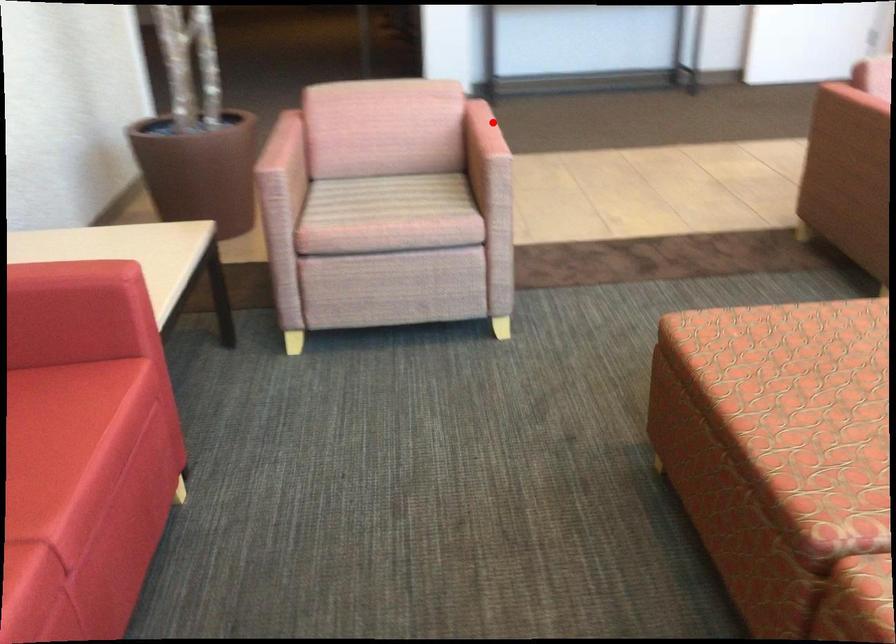
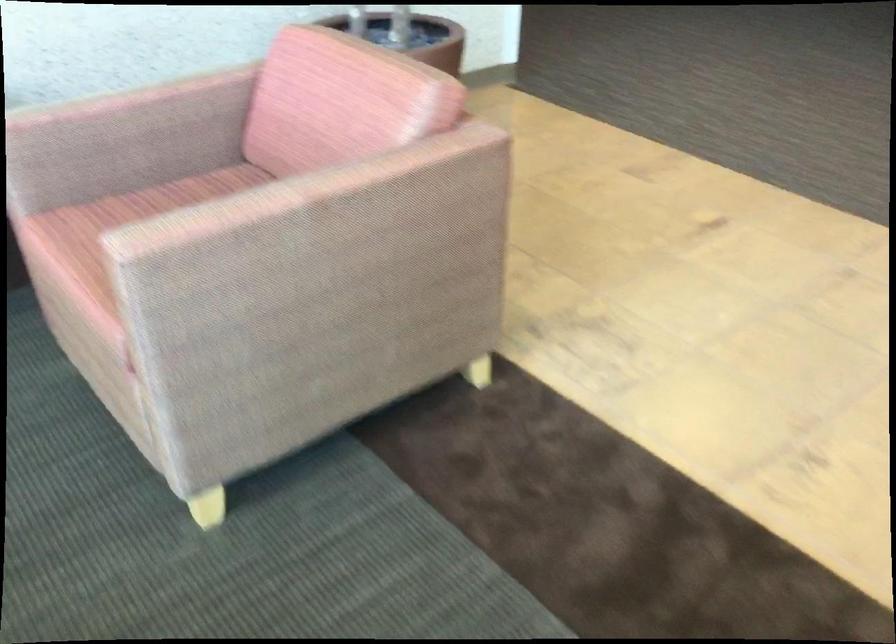
Question: I am providing you with two images of the same scene from different viewpoints. Given a red point in image1, look at the same physical point in image2. Is it:

Choices:
 (A) Closer to the viewpoint
 (B) Farther from the viewpoint

Answer: (A)